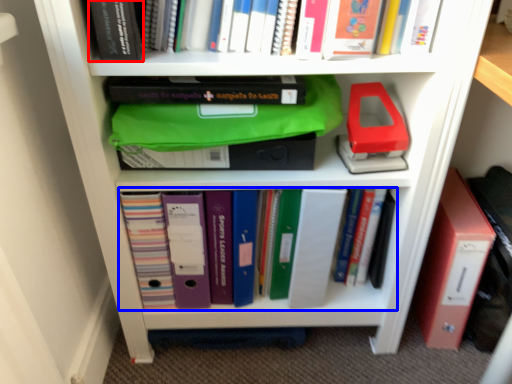
Question: Which of the following is the farthest to the observer, book (highlighted by a red box) or book (highlighted by a blue box)?

Choices:
 (A) book
 (B) book

Answer: (B)